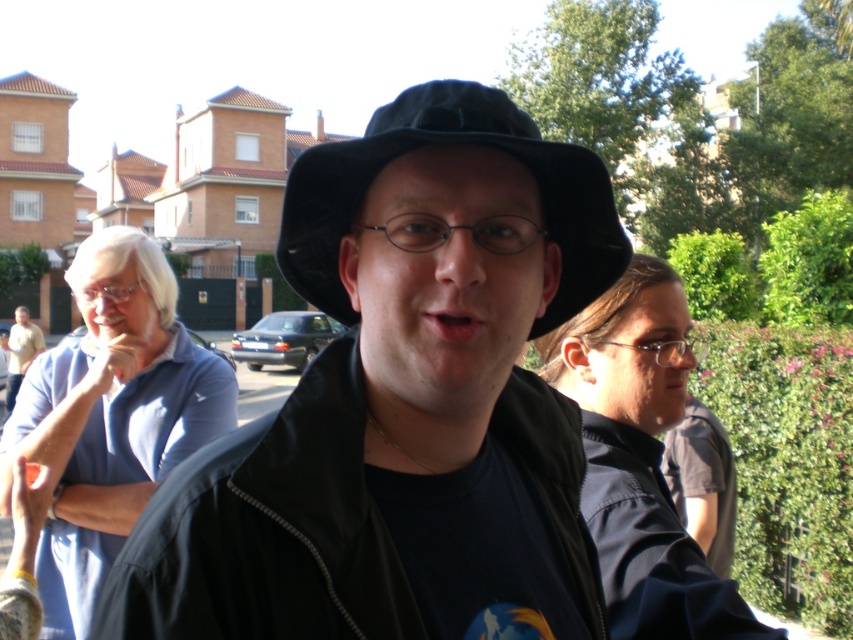
You are a fashion designer observing the image and want to create a new hat design that combines elements from both the black matte hat at center and the black fabric fedora at center. Which hat should you use as the base for the brim if you want a wider brim?

The black fabric fedora at center has a wider brim since it is thicker than the black matte hat at center, so you should use the black fabric fedora at center as the base for the brim.

You are a photographer standing 2 meters away from the camera. You want to take a photo of the black matte hat at center. Can you reach it without moving the camera?

The black matte hat at center is 1.58 meters away from the camera. Since you are standing 2 meters away from the camera, you are farther than the hat, so you cannot reach it without moving closer to the camera or the hat.

You are standing in the scene and want to move from the point closer to you to the point farther away. Which path would you take between the two points, point (405, 508) and point (543, 163)?

The path from point (405, 508) to point (543, 163) would be moving away from the viewer since point (405, 508) is closer to the viewer than point (543, 163).